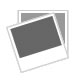
Where is `white space on sides of slanted picture`? The height and width of the screenshot is (80, 80). white space on sides of slanted picture is located at coordinates (11, 40), (58, 29).